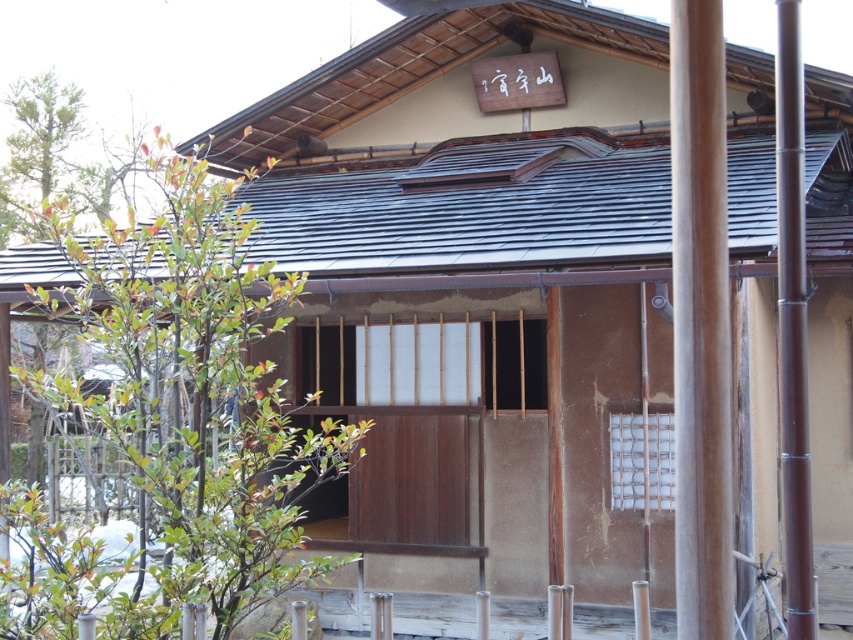
Question: Which point appears farthest from the camera in this image?

Choices:
 (A) (790, 387)
 (B) (689, 16)

Answer: (A)

Question: From the image, what is the correct spatial relationship of brown wood pole at right in relation to brown bamboo pole at right?

Choices:
 (A) left
 (B) right

Answer: (A)

Question: Which object appears farthest from the camera in this image?

Choices:
 (A) brown wood pole at right
 (B) brown bamboo pole at right

Answer: (B)

Question: Can you confirm if brown wood pole at right is positioned to the right of brown bamboo pole at right?

Choices:
 (A) no
 (B) yes

Answer: (A)

Question: Where is brown wood pole at right located in relation to brown bamboo pole at right in the image?

Choices:
 (A) left
 (B) right

Answer: (A)

Question: Which of the following is the farthest from the observer?

Choices:
 (A) (706, 445)
 (B) (779, 147)

Answer: (B)